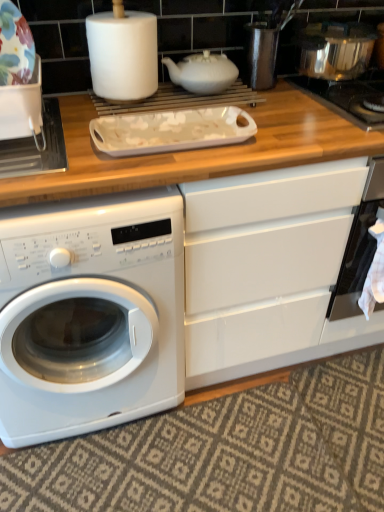
Question: Does stainless steel gas stove at upper right have a larger size compared to porcelain floral plate at upper left, the second appliance in the right-to-left sequence?

Choices:
 (A) no
 (B) yes

Answer: (B)

Question: From the image's perspective, is stainless steel gas stove at upper right on top of porcelain floral plate at upper left, arranged as the first appliance when ordered from the bottom?

Choices:
 (A) no
 (B) yes

Answer: (B)

Question: Is stainless steel gas stove at upper right to the left of porcelain floral plate at upper left, the second appliance in the right-to-left sequence, from the viewer's perspective?

Choices:
 (A) yes
 (B) no

Answer: (B)

Question: Can you confirm if stainless steel gas stove at upper right is smaller than porcelain floral plate at upper left, arranged as the first appliance when ordered from the bottom?

Choices:
 (A) no
 (B) yes

Answer: (A)

Question: Does stainless steel gas stove at upper right have a lesser height compared to porcelain floral plate at upper left, which is the 1th appliance in front-to-back order?

Choices:
 (A) yes
 (B) no

Answer: (A)

Question: Is stainless steel gas stove at upper right beside porcelain floral plate at upper left, which is counted as the 1th appliance, starting from the left?

Choices:
 (A) yes
 (B) no

Answer: (B)

Question: Considering the relative sizes of shiny metallic pot at upper right, the first appliance viewed from the top, and porcelain floral plate at upper left, which is counted as the 1th appliance, starting from the left, in the image provided, is shiny metallic pot at upper right, the first appliance viewed from the top, taller than porcelain floral plate at upper left, which is counted as the 1th appliance, starting from the left,?

Choices:
 (A) yes
 (B) no

Answer: (A)

Question: Is shiny metallic pot at upper right, the second appliance in the left-to-right sequence, to the left of porcelain floral plate at upper left, which is counted as the 1th appliance, starting from the left, from the viewer's perspective?

Choices:
 (A) no
 (B) yes

Answer: (A)

Question: Is shiny metallic pot at upper right, the first appliance when ordered from back to front, smaller than porcelain floral plate at upper left, the second appliance positioned from the back?

Choices:
 (A) yes
 (B) no

Answer: (B)

Question: From the image's perspective, is shiny metallic pot at upper right, arranged as the second appliance when viewed from the front, over porcelain floral plate at upper left, arranged as the 2th appliance when viewed from the top?

Choices:
 (A) no
 (B) yes

Answer: (B)

Question: Is shiny metallic pot at upper right, the second appliance in the left-to-right sequence, further to the viewer compared to porcelain floral plate at upper left, arranged as the 2th appliance when viewed from the top?

Choices:
 (A) no
 (B) yes

Answer: (B)

Question: Could you tell me if shiny metallic pot at upper right, the second appliance in the left-to-right sequence, is facing porcelain floral plate at upper left, which is the 1th appliance in front-to-back order?

Choices:
 (A) no
 (B) yes

Answer: (A)

Question: Is shiny metallic pot at upper right, arranged as the second appliance when viewed from the front, located within black glass oven at right?

Choices:
 (A) no
 (B) yes

Answer: (A)